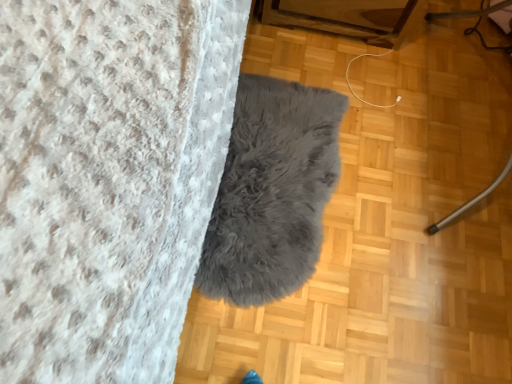
The width and height of the screenshot is (512, 384). What do you see at coordinates (272, 191) in the screenshot?
I see `gray fluffy rug at center` at bounding box center [272, 191].

The width and height of the screenshot is (512, 384). In order to click on gray fluffy rug at center in this screenshot , I will do `click(272, 191)`.

The width and height of the screenshot is (512, 384). I want to click on metallic silver vacuum cleaner at right, so click(x=477, y=21).

This screenshot has height=384, width=512. What do you see at coordinates (477, 21) in the screenshot? I see `metallic silver vacuum cleaner at right` at bounding box center [477, 21].

You are a GUI agent. You are given a task and a screenshot of the screen. Output one action in this format:
    pyautogui.click(x=<x>, y=<y>)
    Task: Click on the gray fluffy rug at center
    The height and width of the screenshot is (384, 512).
    Given the screenshot: What is the action you would take?
    pyautogui.click(x=272, y=191)

From the picture: Considering the relative positions of metallic silver vacuum cleaner at right and gray fluffy rug at center in the image provided, is metallic silver vacuum cleaner at right to the right of gray fluffy rug at center from the viewer's perspective?

Yes.

Considering their positions, is metallic silver vacuum cleaner at right located in front of or behind gray fluffy rug at center?

metallic silver vacuum cleaner at right is positioned closer to the viewer than gray fluffy rug at center.

Is point (468, 32) closer or farther from the camera than point (264, 232)?

Point (468, 32) is positioned farther from the camera compared to point (264, 232).

From the image's perspective, is metallic silver vacuum cleaner at right above gray fluffy rug at center?

Yes, from the image's perspective, metallic silver vacuum cleaner at right is over gray fluffy rug at center.

From a real-world perspective, is metallic silver vacuum cleaner at right located higher than gray fluffy rug at center?

Yes.

Is metallic silver vacuum cleaner at right wider or thinner than gray fluffy rug at center?

In the image, metallic silver vacuum cleaner at right appears to be more narrow than gray fluffy rug at center.

Can you confirm if metallic silver vacuum cleaner at right is taller than gray fluffy rug at center?

Correct, metallic silver vacuum cleaner at right is much taller as gray fluffy rug at center.

Which of these two, metallic silver vacuum cleaner at right or gray fluffy rug at center, is smaller?

With smaller size is gray fluffy rug at center.

Is metallic silver vacuum cleaner at right located outside gray fluffy rug at center?

Yes, metallic silver vacuum cleaner at right is not within gray fluffy rug at center.

Is the surface of metallic silver vacuum cleaner at right in direct contact with gray fluffy rug at center?

metallic silver vacuum cleaner at right and gray fluffy rug at center are not in contact.

Is metallic silver vacuum cleaner at right oriented away from gray fluffy rug at center?

No, metallic silver vacuum cleaner at right is not facing away from gray fluffy rug at center.

Can you tell me how much metallic silver vacuum cleaner at right and gray fluffy rug at center differ in facing direction?

The facing directions of metallic silver vacuum cleaner at right and gray fluffy rug at center are 172 degrees apart.

At what (x,y) coordinates should I click in order to perform the action: click on blanket lying behind the metallic silver vacuum cleaner at right. Please return your answer as a coordinate pair (x, y). The width and height of the screenshot is (512, 384). Looking at the image, I should click on (272, 191).

Based on the photo, considering the positions of objects gray fluffy rug at center and metallic silver vacuum cleaner at right in the image provided, who is more to the right, gray fluffy rug at center or metallic silver vacuum cleaner at right?

metallic silver vacuum cleaner at right.

Based on the photo, does gray fluffy rug at center lie behind metallic silver vacuum cleaner at right?

Yes, it is.

Considering the positions of point (263, 131) and point (473, 27), is point (263, 131) closer or farther from the camera than point (473, 27)?

Point (263, 131) is closer to the camera than point (473, 27).

From the image's perspective, which one is positioned higher, gray fluffy rug at center or metallic silver vacuum cleaner at right?

From the image's view, metallic silver vacuum cleaner at right is above.

From a real-world perspective, is gray fluffy rug at center below metallic silver vacuum cleaner at right?

Yes, from a real-world perspective, gray fluffy rug at center is beneath metallic silver vacuum cleaner at right.

Does gray fluffy rug at center have a greater width compared to metallic silver vacuum cleaner at right?

Correct, the width of gray fluffy rug at center exceeds that of metallic silver vacuum cleaner at right.

Consider the image. Considering the sizes of objects gray fluffy rug at center and metallic silver vacuum cleaner at right in the image provided, who is shorter, gray fluffy rug at center or metallic silver vacuum cleaner at right?

Standing shorter between the two is gray fluffy rug at center.

Is gray fluffy rug at center bigger than metallic silver vacuum cleaner at right?

No, gray fluffy rug at center is not bigger than metallic silver vacuum cleaner at right.

In the scene shown: Do you think gray fluffy rug at center is within metallic silver vacuum cleaner at right, or outside of it?

The correct answer is: outside.

Are gray fluffy rug at center and metallic silver vacuum cleaner at right far apart?

That's not correct — gray fluffy rug at center is a little close to metallic silver vacuum cleaner at right.

Is gray fluffy rug at center positioned with its back to metallic silver vacuum cleaner at right?

No, gray fluffy rug at center is not facing the opposite direction of metallic silver vacuum cleaner at right.

How many degrees apart are the facing directions of gray fluffy rug at center and metallic silver vacuum cleaner at right?

172 degrees.

Find the location of a particular element. The width and height of the screenshot is (512, 384). furniture above the gray fluffy rug at center (from a real-world perspective) is located at coordinates (477, 21).

The image size is (512, 384). Identify the location of furniture on the right of gray fluffy rug at center. (477, 21).

Where is `blanket below the metallic silver vacuum cleaner at right (from the image's perspective)`? blanket below the metallic silver vacuum cleaner at right (from the image's perspective) is located at coordinates (272, 191).